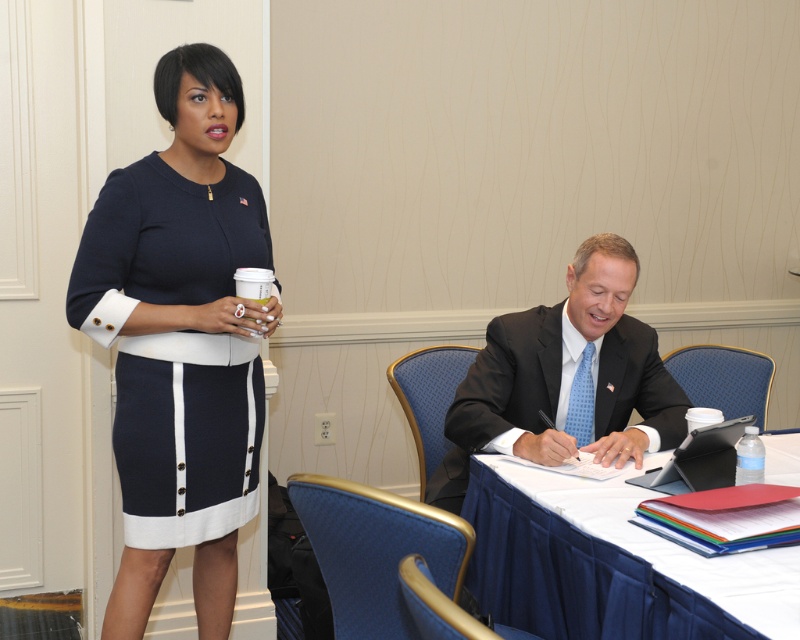
Does point (180, 410) lie behind point (630, 332)?

No.

Which is more to the left, navy knit dress at upper left or dark gray suit at center?

→ From the viewer's perspective, navy knit dress at upper left appears more on the left side.

Who is more forward, (173, 177) or (506, 420)?

Point (173, 177) is more forward.

The height and width of the screenshot is (640, 800). Identify the location of navy knit dress at upper left. (186, 435).

Who is positioned more to the left, white cloth-covered table at lower right or dark gray suit at center?

dark gray suit at center is more to the left.

From the picture: Does white cloth-covered table at lower right appear under dark gray suit at center?

Yes.

Does point (658, 547) come closer to viewer compared to point (621, 369)?

Yes, it is in front of point (621, 369).

What are the coordinates of `white cloth-covered table at lower right` in the screenshot? It's located at [609, 564].

Which is above, navy knit dress at upper left or white cloth-covered table at lower right?

navy knit dress at upper left

Find the location of a particular element. navy knit dress at upper left is located at coordinates (186, 435).